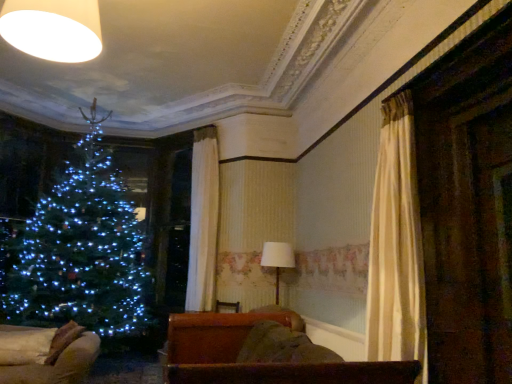
Question: Is white fabric lampshade at center bigger or smaller than white matte lampshade at upper left?

Choices:
 (A) small
 (B) big

Answer: (B)

Question: Considering the positions of point (280, 254) and point (64, 51), is point (280, 254) closer or farther from the camera than point (64, 51)?

Choices:
 (A) farther
 (B) closer

Answer: (A)

Question: Estimate the real-world distances between objects in this image. Which object is farther from the white fabric lampshade at center?

Choices:
 (A) white matte lampshade at upper left
 (B) brown leather couch at lower center, which ranks as the 1th furniture in right-to-left order
 (C) velvet beige sofa at lower left, the 2th furniture positioned from the right

Answer: (A)

Question: Estimate the real-world distances between objects in this image. Which object is closer to the brown leather couch at lower center, the second furniture viewed from the left?

Choices:
 (A) white fabric lampshade at center
 (B) white matte lampshade at upper left
 (C) velvet beige sofa at lower left, the 2th furniture positioned from the right

Answer: (C)